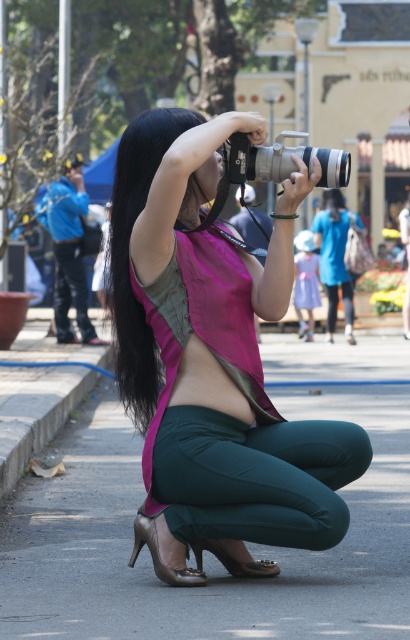
Consider the image. You are a photographer trying to capture a wide shot of the scene. You have a matte silver camera at center and another camera. Which camera should you use to ensure you can include all the background elements in your photo?

The matte silver camera at center is 6.90 meters away from the other camera. To capture a wide shot including all background elements, you should use the matte silver camera at center since it is positioned further back, allowing for a broader perspective.

In the scene shown: You are a photographer aiming to capture a photo of both the skinny green pants at center and the purple satin dress at upper center in the same frame. Given their distance apart, can you estimate whether they can be included in a single shot without zooming in?

The skinny green pants at center and purple satin dress at upper center are 15.68 meters apart from each other. Depending on the camera lens used, a wide angle lens might be necessary to capture both subjects in the same frame without zooming in. However, standard lenses may struggle with this distance. It would require adjusting the camera position or using appropriate equipment to ensure both are visible.

You are a photographer trying to capture a clear shot of the woman in the scene. The black silky hair at center and the skinny green pants at center are both in your viewfinder. Which object should you adjust your focus to ensure the subject is sharp?

The black silky hair at center might be wider than skinny green pants at center, so focusing on the black silky hair at center would ensure the subject is sharp as it occupies more space in the frame.